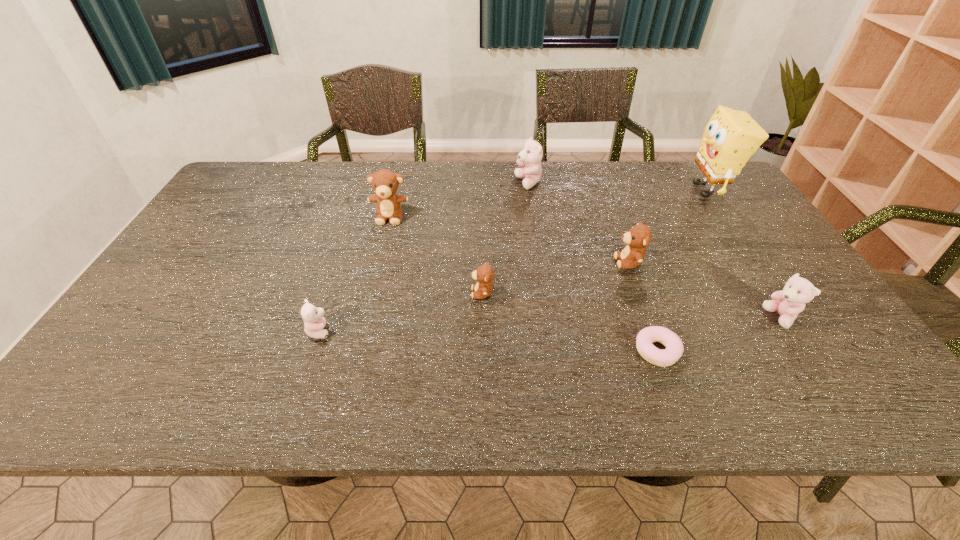
The height and width of the screenshot is (540, 960). Find the location of `free spot located 0.270m at the face of the farthest teddy bear`. free spot located 0.270m at the face of the farthest teddy bear is located at coordinates [x=434, y=183].

You are a GUI agent. You are given a task and a screenshot of the screen. Output one action in this format:
    pyautogui.click(x=<x>, y=<y>)
    Task: Click on the free space located at the face of the farthest teddy bear
    
    Given the screenshot: What is the action you would take?
    pyautogui.click(x=482, y=183)

Locate an element on the screen. The height and width of the screenshot is (540, 960). free location located 0.070m on the face of the fifth teddy bear from right to left is located at coordinates (x=384, y=241).

The width and height of the screenshot is (960, 540). Find the location of `free space located 0.240m on the face of the fourth nearest teddy bear`. free space located 0.240m on the face of the fourth nearest teddy bear is located at coordinates (526, 262).

Identify the location of blank area located on the face of the fourth nearest teddy bear. (496, 262).

What are the coordinates of `vacant space located 0.050m on the face of the fourth nearest teddy bear` in the screenshot? It's located at (596, 262).

Where is `vacant region located 0.230m at the face of the rightmost teddy bear`? The width and height of the screenshot is (960, 540). vacant region located 0.230m at the face of the rightmost teddy bear is located at coordinates (669, 318).

Find the location of a particular element. vacant space located at the face of the rightmost teddy bear is located at coordinates (715, 318).

Identify the location of vacant space located at the face of the rightmost teddy bear. (723, 318).

Locate an element on the screen. vacant region located on the face of the smallest brown teddy bear is located at coordinates (324, 293).